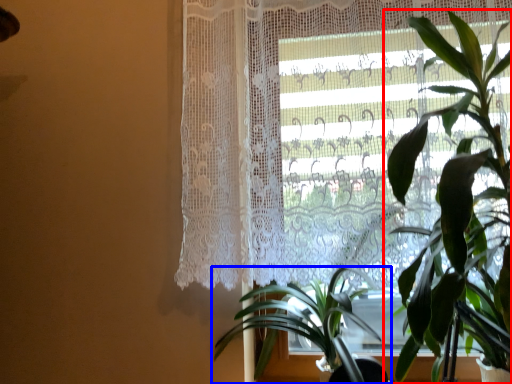
Question: Which object appears farthest to the camera in this image, houseplant (highlighted by a red box) or houseplant (highlighted by a blue box)?

Choices:
 (A) houseplant
 (B) houseplant

Answer: (B)